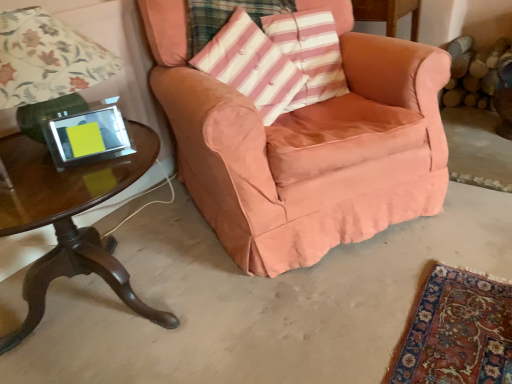
Image resolution: width=512 pixels, height=384 pixels. Identify the location of free space between shiny dark wood table at lower left and suede-like peach armchair at center. coord(209,258).